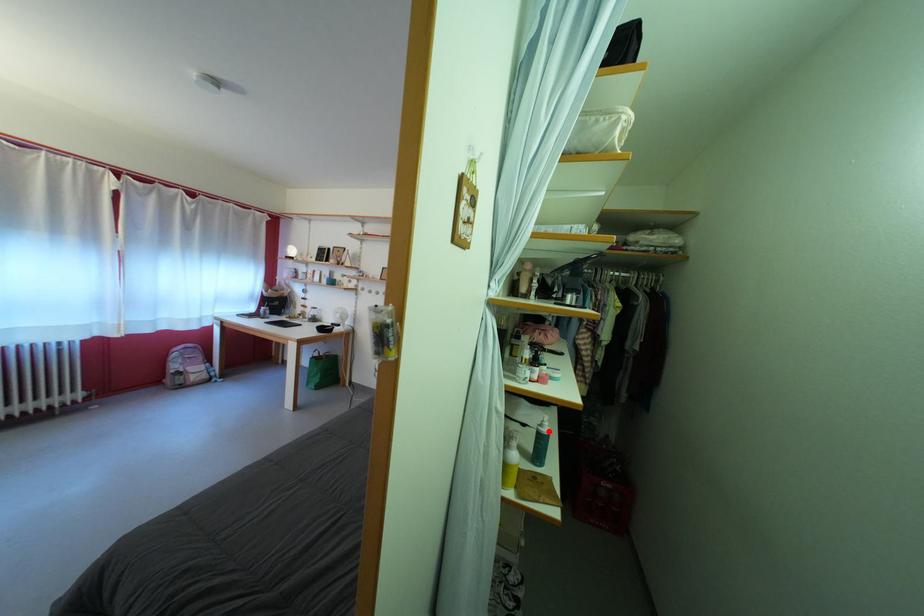
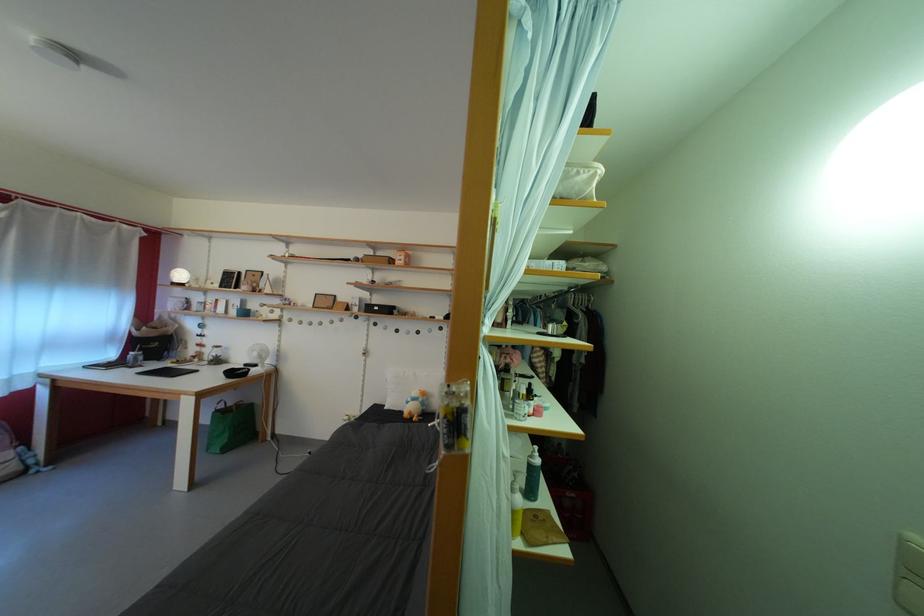
Locate, in the second image, the point that corresponds to the highlighted location in the first image.

(540, 463)